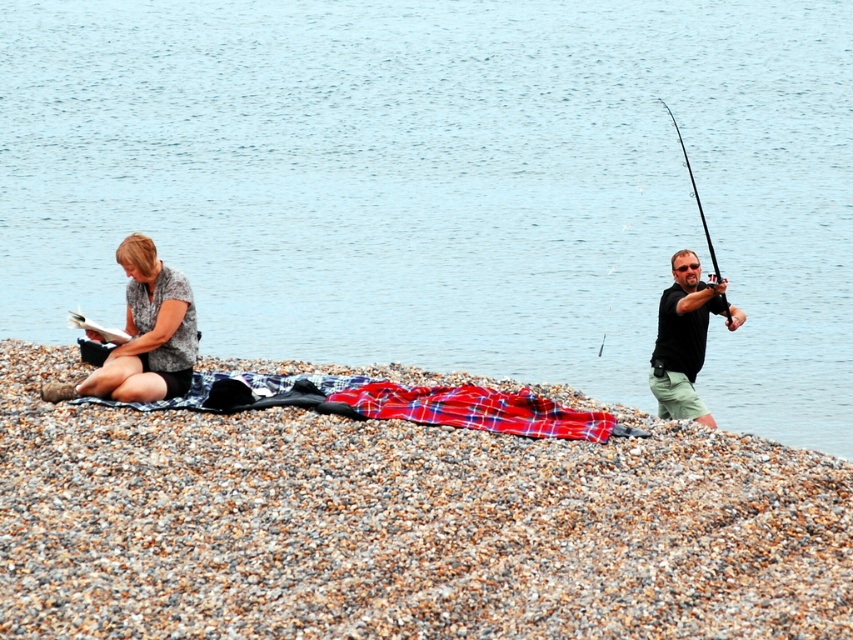
Which of these two, blue water at center or black matte shirt at right, stands taller?

Standing taller between the two is blue water at center.

Between point (151, 116) and point (688, 326), which one is positioned behind?

Positioned behind is point (151, 116).

Find the location of a particular element. This screenshot has height=640, width=853. blue water at center is located at coordinates (445, 184).

Does matte gray shirt at left have a greater width compared to black matte shirt at right?

Indeed, matte gray shirt at left has a greater width compared to black matte shirt at right.

From the picture: Does matte gray shirt at left have a smaller size compared to black matte shirt at right?

No, matte gray shirt at left is not smaller than black matte shirt at right.

Describe the element at coordinates (144, 333) in the screenshot. The height and width of the screenshot is (640, 853). I see `matte gray shirt at left` at that location.

At what (x,y) coordinates should I click in order to perform the action: click on matte gray shirt at left. Please return your answer as a coordinate pair (x, y). This screenshot has height=640, width=853. Looking at the image, I should click on (144, 333).

Who is shorter, black matte shirt at right or black plastic rod at right?

Standing shorter between the two is black matte shirt at right.

Describe the element at coordinates (682, 339) in the screenshot. This screenshot has width=853, height=640. I see `black matte shirt at right` at that location.

Locate an element on the screen. The image size is (853, 640). black matte shirt at right is located at coordinates click(x=682, y=339).

Locate an element on the screen. The width and height of the screenshot is (853, 640). black matte shirt at right is located at coordinates (682, 339).